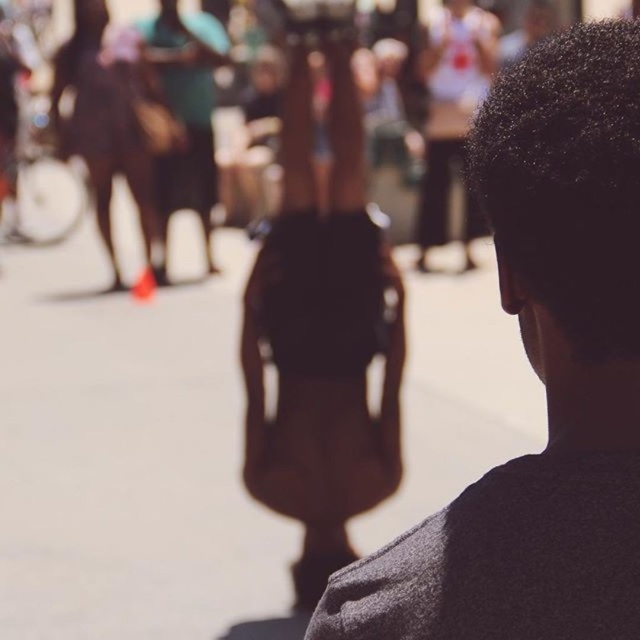
Between dark gray sweater at center and brown leather bag at center, which one is positioned higher?

brown leather bag at center

Who is more distant from viewer, (508, 180) or (326, 284)?

Positioned behind is point (326, 284).

Who is more forward, (637, 364) or (326, 326)?

Positioned in front is point (637, 364).

I want to click on dark gray sweater at center, so click(541, 376).